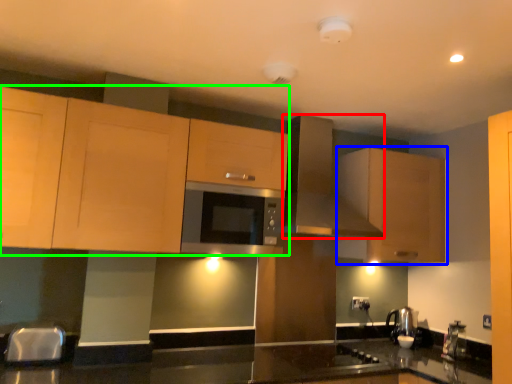
Question: Based on their relative distances, which object is farther from kitchen appliance (highlighted by a red box)? Choose from cabinetry (highlighted by a blue box) and cabinetry (highlighted by a green box).

Choices:
 (A) cabinetry
 (B) cabinetry

Answer: (B)